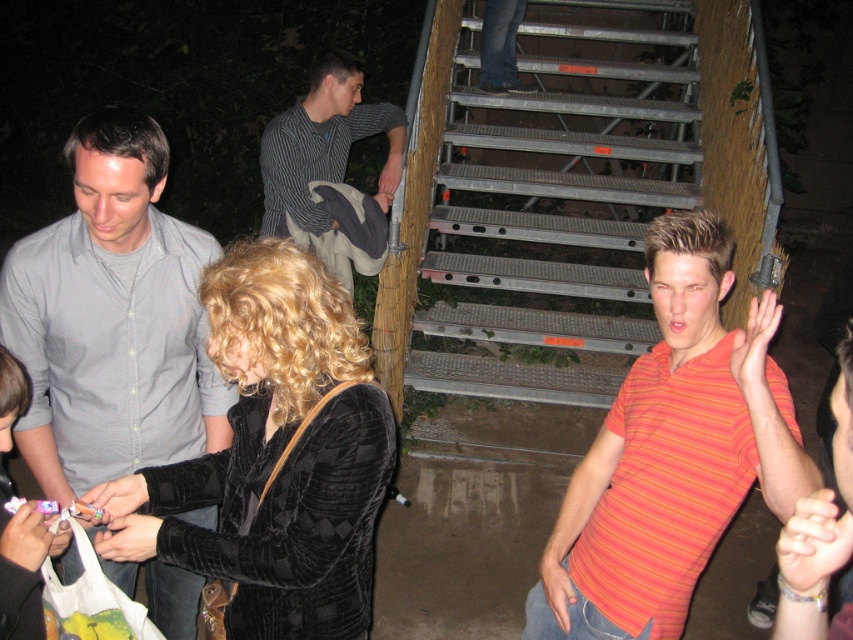
Looking at this image, you are standing at the base of the metal stairs leading into the wooded area at night. You see a woman with curly blonde hair holding something in her hands and a man in a red striped shirt gesturing. How far apart are the gray cotton shirt at center and the woman with curly blonde hair?

The gray cotton shirt at center and the woman with curly blonde hair are 1.87 meters apart.

You are standing at the point with coordinates point (367, 113) and want to walk to the point with coordinates point (521, 65). Is the destination point behind you or in front of you?

The destination point (521, 65) is behind the starting point (367, 113), so it is behind you.